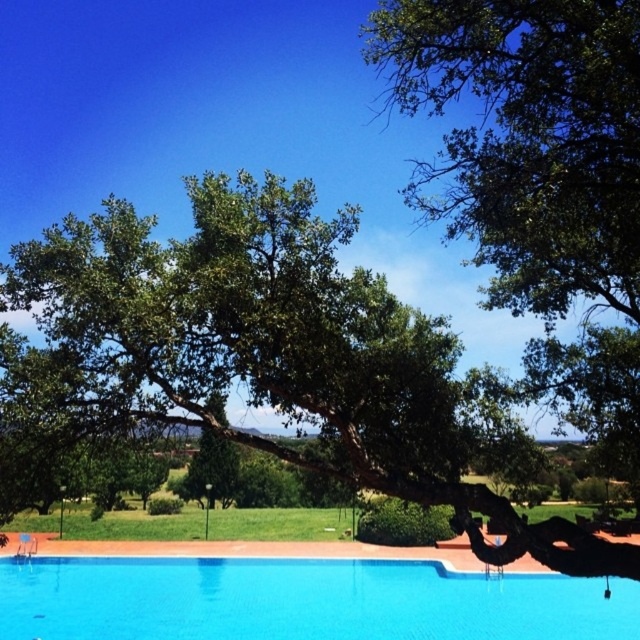
Does green leafy oak tree at upper center have a larger size compared to blue glassy swimming pool at center?

Actually, green leafy oak tree at upper center might be smaller than blue glassy swimming pool at center.

In order to click on green leafy oak tree at upper center in this screenshot , I will do `click(276, 355)`.

The image size is (640, 640). What are the coordinates of `green leafy oak tree at upper center` in the screenshot? It's located at (276, 355).